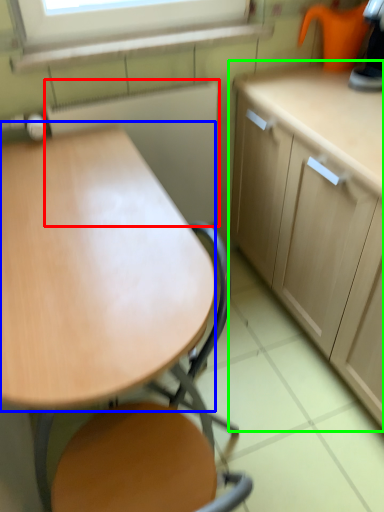
Question: Estimate the real-world distances between objects in this image. Which object is farther from appliance (highlighted by a red box), round table (highlighted by a blue box) or cabinetry (highlighted by a green box)?

Choices:
 (A) round table
 (B) cabinetry

Answer: (A)